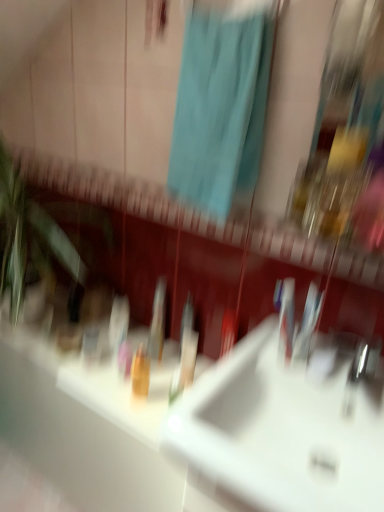
Question: Is teal fabric shower curtain at upper center situated inside translucent orange bottle at center or outside?

Choices:
 (A) outside
 (B) inside

Answer: (A)

Question: Considering the positions of teal fabric shower curtain at upper center and translucent orange bottle at center in the image, is teal fabric shower curtain at upper center wider or thinner than translucent orange bottle at center?

Choices:
 (A) thin
 (B) wide

Answer: (B)

Question: Estimate the real-world distances between objects in this image. Which object is farther from the teal fabric shower curtain at upper center?

Choices:
 (A) white glossy sink at center
 (B) translucent orange bottle at center
 (C) translucent plastic toothbrush at center

Answer: (B)

Question: Which object is the farthest from the teal fabric shower curtain at upper center?

Choices:
 (A) translucent plastic toothbrush at center
 (B) translucent orange bottle at center
 (C) white glossy sink at center

Answer: (B)